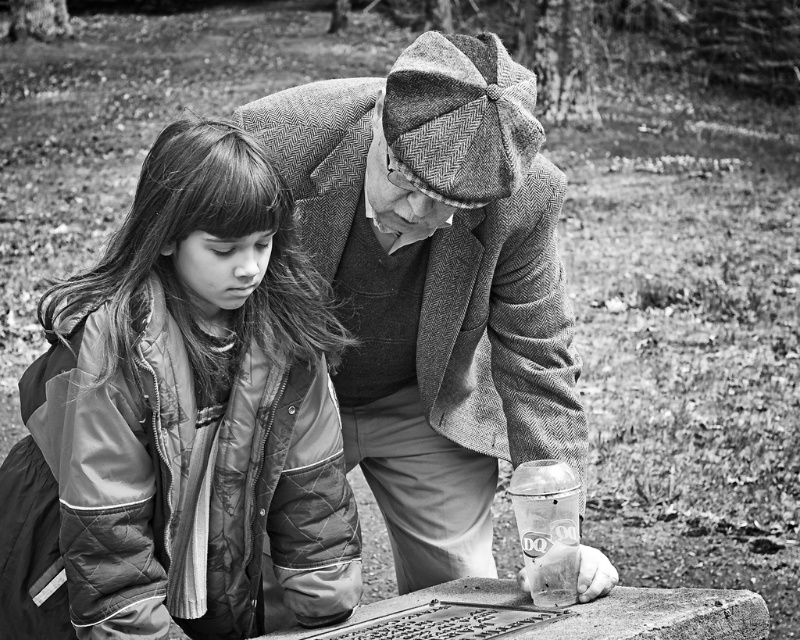
You are a fashion designer observing the scene. You need to determine which clothing item is more suitable for a winter collection. Based on the description of the quilted nylon jacket at center and the woolen coat at center, which one would you choose?

The woolen coat at center is more suitable for a winter collection because it is larger in size compared to the quilted nylon jacket at center, suggesting it provides better insulation and warmth.

You are a fashion designer observing the two jackets in the scene. Which jacket, the quilted nylon jacket at center or the woolen coat at center, is narrower in width?

The quilted nylon jacket at center is narrower in width than the woolen coat at center.